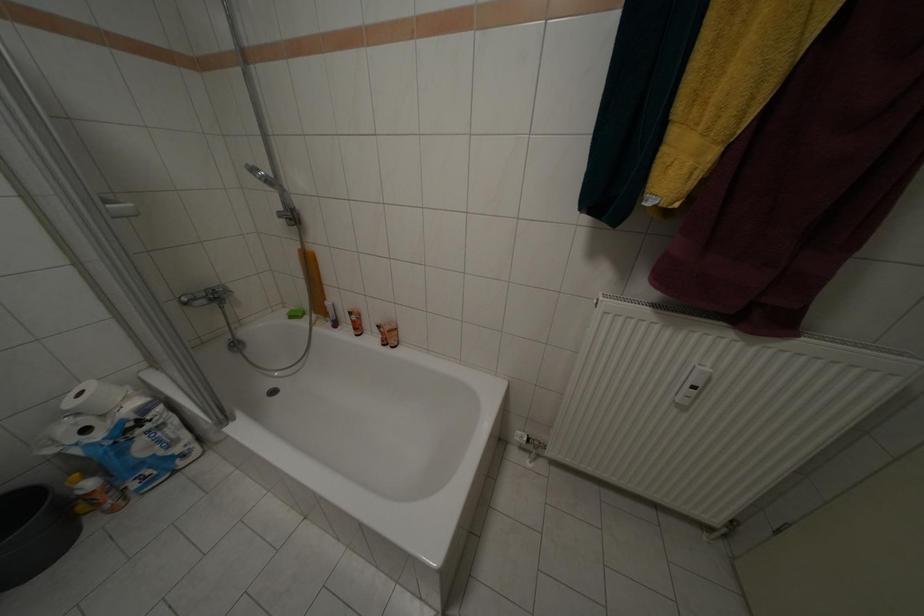
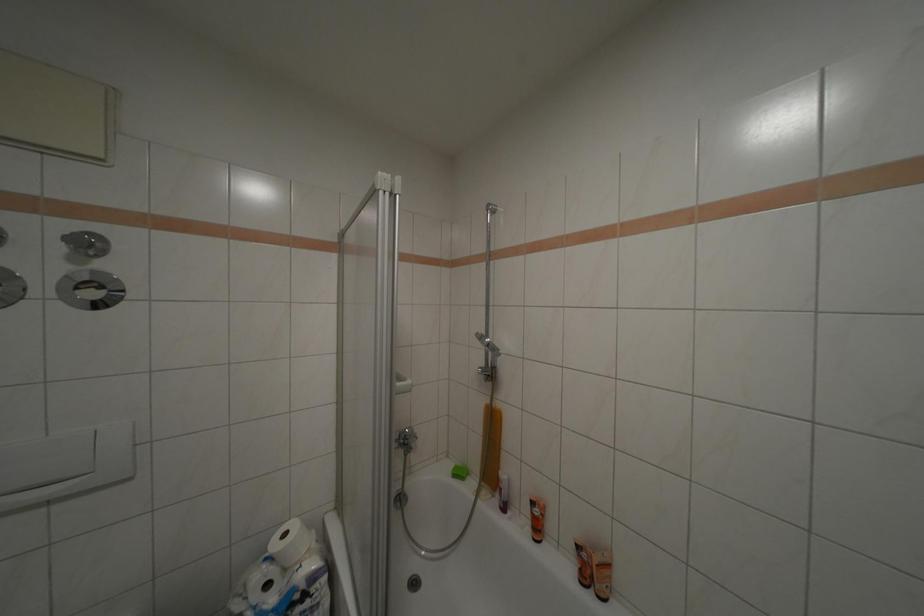
The first image is from the beginning of the video and the second image is from the end. How did the camera likely rotate when shooting the video?

The rotation direction of the camera is left-up.